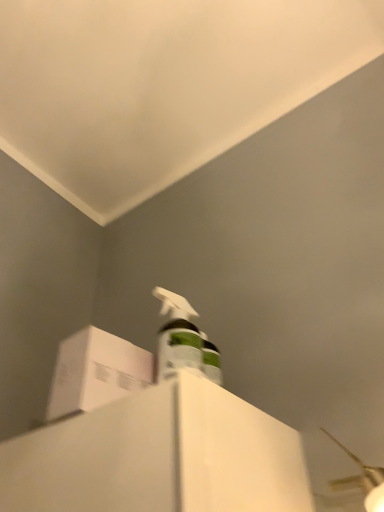
Identify the location of white cardboard box at upper left. (96, 372).

What is the approximate width of white cardboard box at upper left?

The width of white cardboard box at upper left is 7.46 inches.

Describe the element at coordinates (96, 372) in the screenshot. I see `white cardboard box at upper left` at that location.

The height and width of the screenshot is (512, 384). I want to click on white cardboard box at upper left, so click(96, 372).